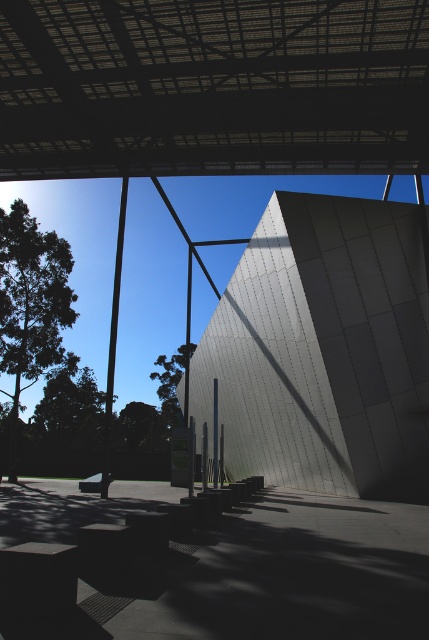
You are standing in front of the modern architectural structure and see the smooth gray wall at center and the green leafy tree at center. Which object is located to the right of the other?

The smooth gray wall at center is positioned on the right side of the green leafy tree at center, so the smooth gray wall at center is to the right of the green leafy tree at center.

You are standing in front of the modern architectural structure and want to take a photo that includes both the smooth gray wall at center and the green leafy tree at center. Which object should you position closer to the edge of the frame to ensure both fit in the shot?

Since the smooth gray wall at center might be wider than the green leafy tree at center, you should position the smooth gray wall at center closer to the edge of the frame to accommodate its potential width and ensure both objects fit within the shot.

You are standing in front of the modern architectural structure and notice the smooth gray wall at center and the green leafy tree at center. Which object is taller?

The smooth gray wall at center is much taller than the green leafy tree at center.